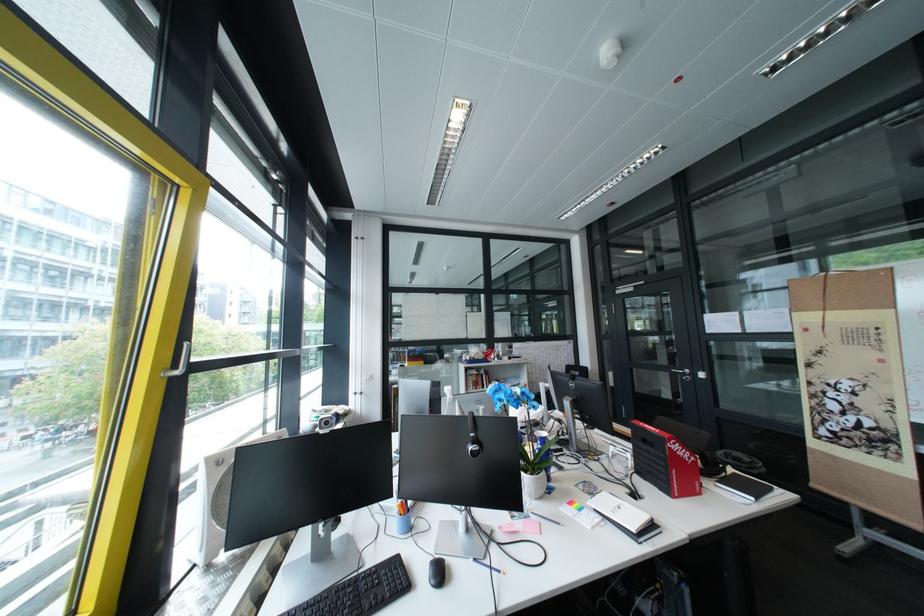
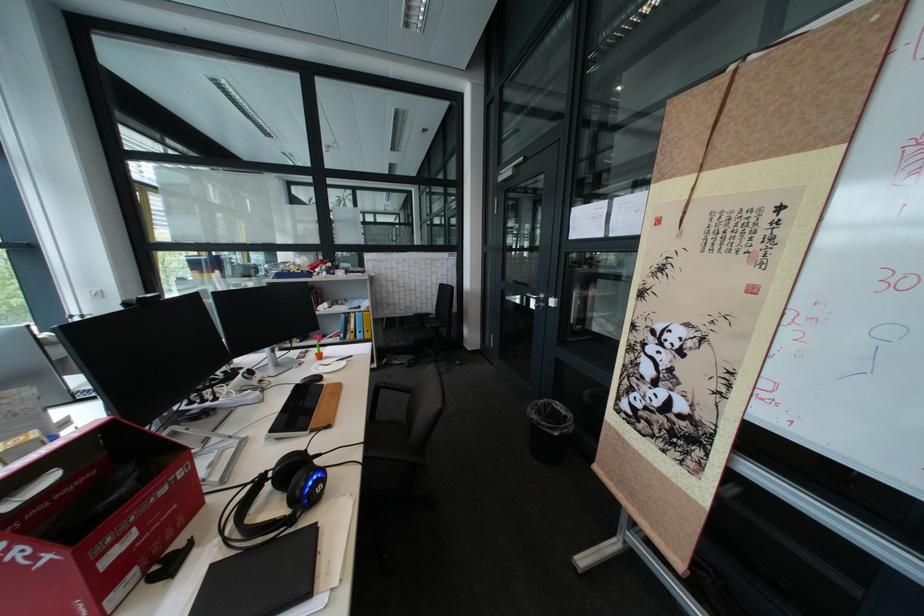
In the second image, find the point that corresponds to [687,371] in the first image.

(541, 294)